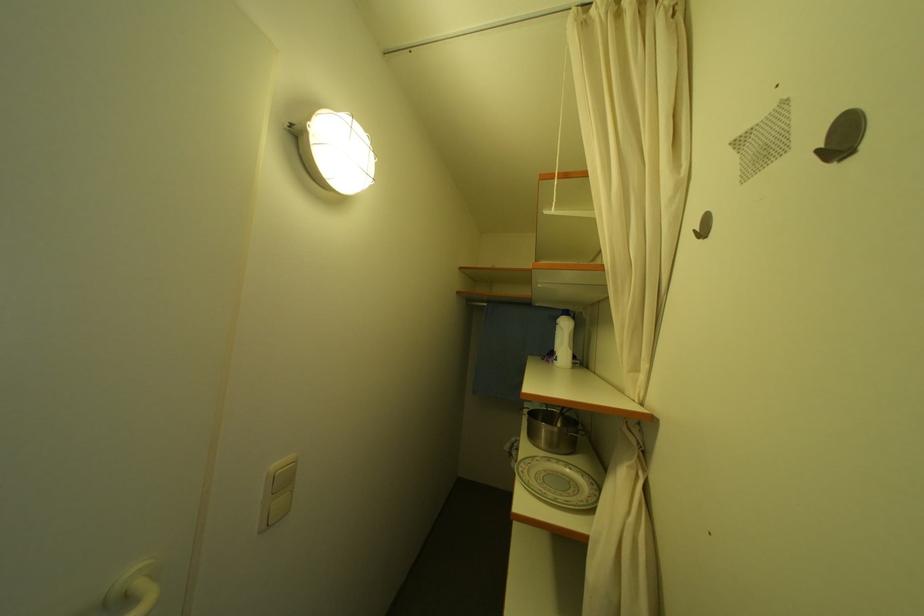
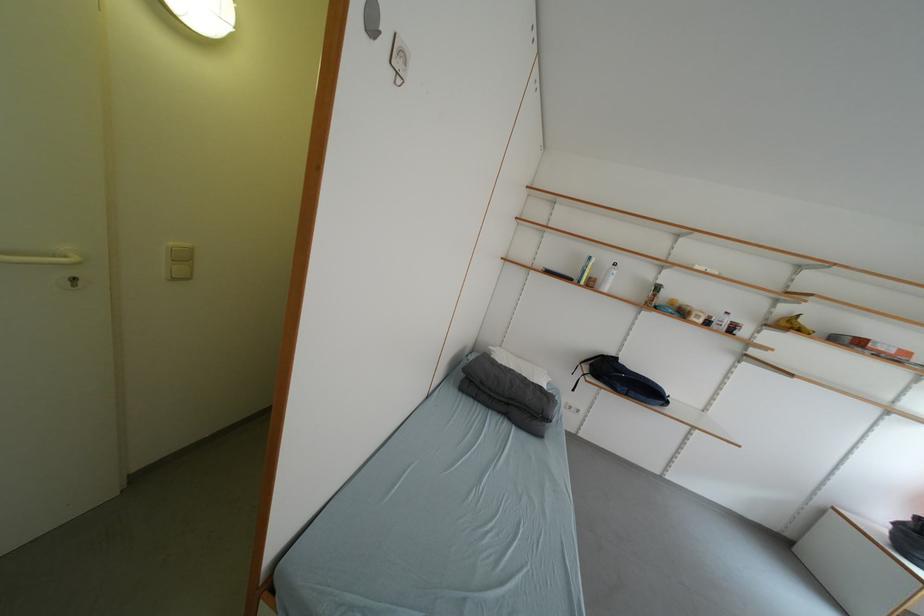
Which direction would the cameraman need to move to produce the second image?

The cameraman walked toward right, backward.